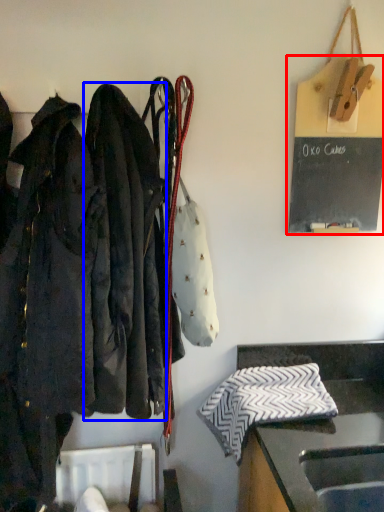
Question: Which point is further to the camera, bulletin board (highlighted by a red box) or jacket (highlighted by a blue box)?

Choices:
 (A) bulletin board
 (B) jacket

Answer: (A)